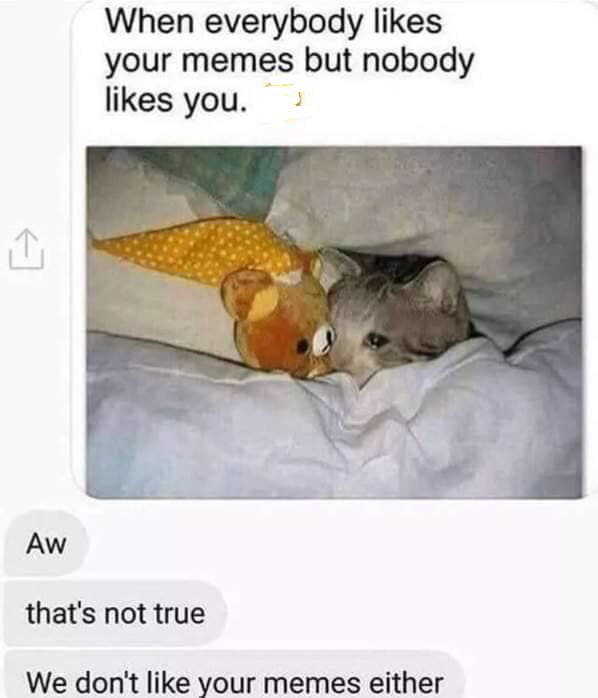
Where is `teddy bear`? This screenshot has height=698, width=598. teddy bear is located at coordinates (288, 329).